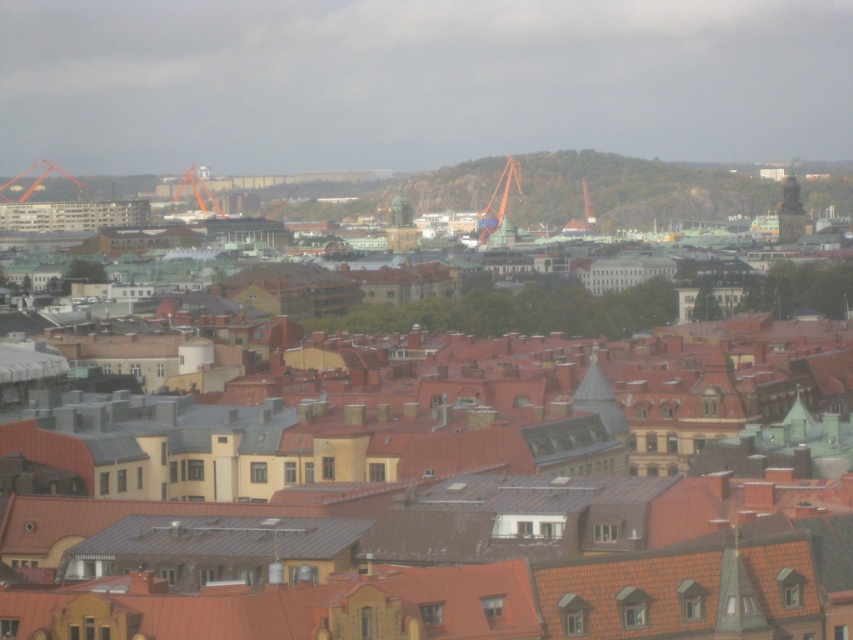
Question: Is brown textured rooftops at center bigger than bronze statue at center?

Choices:
 (A) yes
 (B) no

Answer: (A)

Question: Among these objects, which one is farthest from the camera?

Choices:
 (A) bronze statue at center
 (B) brown textured rooftops at center

Answer: (A)

Question: Among these objects, which one is farthest from the camera?

Choices:
 (A) orange metallic crane at upper center
 (B) matte black tower at upper right
 (C) brown textured rooftops at center
 (D) orange metallic crane at upper left

Answer: (D)

Question: Among these objects, which one is farthest from the camera?

Choices:
 (A) green metallic crane at center
 (B) bronze statue at center
 (C) orange metallic crane at upper center
 (D) matte black tower at upper right

Answer: (C)

Question: Where is orange metallic crane at upper center located in relation to orange metallic crane at upper left in the image?

Choices:
 (A) left
 (B) right

Answer: (B)

Question: Is matte black tower at upper right positioned before orange metallic crane at upper left?

Choices:
 (A) yes
 (B) no

Answer: (A)